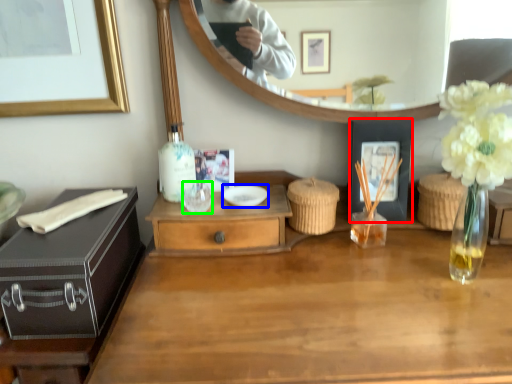
Question: Which is nearer to the picture frame (highlighted by a red box)? bowl (highlighted by a blue box) or wine glass (highlighted by a green box).

Choices:
 (A) bowl
 (B) wine glass

Answer: (A)